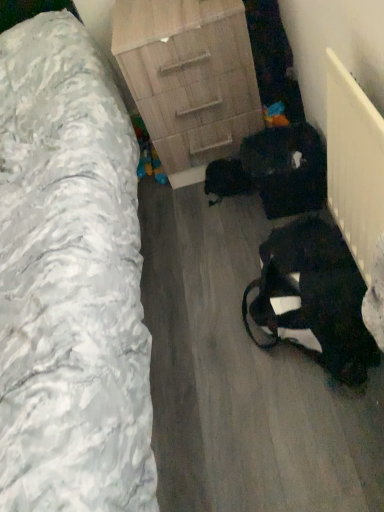
Question: Can you confirm if wooden chest of drawers at center is positioned to the left of wooden nightstand at center?

Choices:
 (A) yes
 (B) no

Answer: (B)

Question: From the image's perspective, is wooden chest of drawers at center on top of wooden nightstand at center?

Choices:
 (A) yes
 (B) no

Answer: (A)

Question: Does wooden chest of drawers at center appear on the right side of wooden nightstand at center?

Choices:
 (A) no
 (B) yes

Answer: (B)

Question: Can you confirm if wooden chest of drawers at center is smaller than wooden nightstand at center?

Choices:
 (A) no
 (B) yes

Answer: (B)

Question: Does wooden chest of drawers at center have a lesser width compared to wooden nightstand at center?

Choices:
 (A) no
 (B) yes

Answer: (B)

Question: Is wooden chest of drawers at center further to camera compared to wooden nightstand at center?

Choices:
 (A) yes
 (B) no

Answer: (A)

Question: Is wooden nightstand at center wider than black fabric bag at lower right?

Choices:
 (A) no
 (B) yes

Answer: (B)

Question: From a real-world perspective, does wooden nightstand at center stand above black fabric bag at lower right?

Choices:
 (A) no
 (B) yes

Answer: (B)

Question: Is wooden nightstand at center oriented away from black fabric bag at lower right?

Choices:
 (A) no
 (B) yes

Answer: (A)

Question: Is wooden nightstand at center shorter than black fabric bag at lower right?

Choices:
 (A) no
 (B) yes

Answer: (A)

Question: From the image's perspective, is wooden nightstand at center beneath black fabric bag at lower right?

Choices:
 (A) no
 (B) yes

Answer: (A)

Question: Considering the relative sizes of wooden nightstand at center and black fabric bag at lower right in the image provided, is wooden nightstand at center thinner than black fabric bag at lower right?

Choices:
 (A) no
 (B) yes

Answer: (A)

Question: Does black fabric bag at lower right have a larger size compared to wooden chest of drawers at center?

Choices:
 (A) no
 (B) yes

Answer: (A)